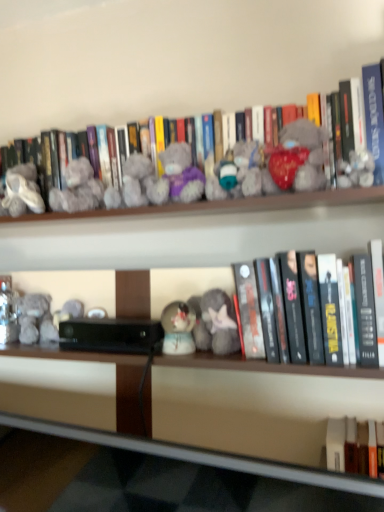
Question: Can you confirm if black matte book at center, the 2th book positioned from the top, is smaller than wooden at lower center?

Choices:
 (A) yes
 (B) no

Answer: (A)

Question: Is black matte book at center, which appears as the 1th book when ordered from the bottom, further to the viewer compared to wooden at lower center?

Choices:
 (A) no
 (B) yes

Answer: (B)

Question: From a real-world perspective, is black matte book at center, which appears as the 1th book when ordered from the bottom, below wooden at lower center?

Choices:
 (A) yes
 (B) no

Answer: (B)

Question: Can you confirm if black matte book at center, which appears as the 1th book when ordered from the bottom, is positioned to the right of wooden at lower center?

Choices:
 (A) yes
 (B) no

Answer: (A)

Question: Is black matte book at center, which appears as the 1th book when ordered from the bottom, in contact with wooden at lower center?

Choices:
 (A) no
 (B) yes

Answer: (A)

Question: Is wooden at lower center bigger or smaller than fuzzy fabric teddy bear at center, the 5th toy viewed from the right?

Choices:
 (A) big
 (B) small

Answer: (A)

Question: Based on their positions, is wooden at lower center located to the left or right of fuzzy fabric teddy bear at center, which is the third toy from left to right?

Choices:
 (A) left
 (B) right

Answer: (A)

Question: From a real-world perspective, is wooden at lower center physically located above or below fuzzy fabric teddy bear at center, which is the third toy from left to right?

Choices:
 (A) above
 (B) below

Answer: (B)

Question: Do you think wooden at lower center is within fuzzy fabric teddy bear at center, the 5th toy viewed from the right, or outside of it?

Choices:
 (A) inside
 (B) outside

Answer: (B)

Question: Considering the positions of point (162, 159) and point (370, 485), is point (162, 159) closer or farther from the camera than point (370, 485)?

Choices:
 (A) closer
 (B) farther

Answer: (B)

Question: From their relative heights in the image, would you say fuzzy fabric teddy bear at center, the 5th toy viewed from the right, is taller or shorter than wooden at lower center?

Choices:
 (A) short
 (B) tall

Answer: (A)

Question: From a real-world perspective, is fuzzy fabric teddy bear at center, which is the third toy from left to right, positioned above or below wooden at lower center?

Choices:
 (A) above
 (B) below

Answer: (A)

Question: From the image's perspective, is fuzzy fabric teddy bear at center, the 5th toy viewed from the right, positioned above or below wooden at lower center?

Choices:
 (A) below
 (B) above

Answer: (B)

Question: From the image's perspective, is matte gray plush at center, positioned as the 2th toy in right-to-left order, positioned above or below fluffy gray plush at center, which ranks as the fourth toy in left-to-right order?

Choices:
 (A) below
 (B) above

Answer: (B)

Question: Is matte gray plush at center, positioned as the sixth toy in left-to-right order, in front of or behind fluffy gray plush at center, which ranks as the fourth toy in left-to-right order, in the image?

Choices:
 (A) front
 (B) behind

Answer: (A)